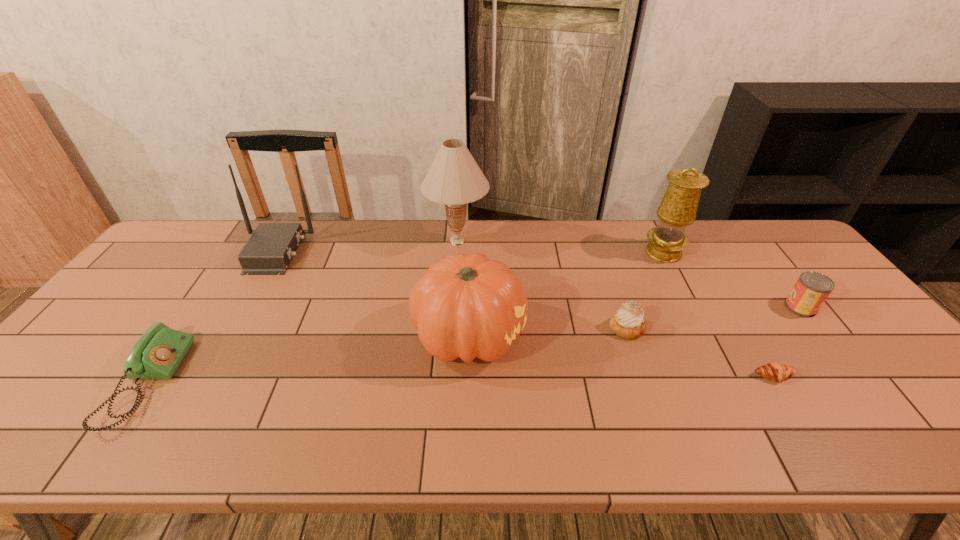
I want to click on lampshade, so click(454, 178).

The height and width of the screenshot is (540, 960). Identify the location of oil lamp. (678, 208).

Where is `router`? This screenshot has width=960, height=540. router is located at coordinates (269, 250).

Locate an element on the screen. This screenshot has width=960, height=540. pumpkin is located at coordinates (466, 306).

Where is `can`? This screenshot has width=960, height=540. can is located at coordinates (811, 290).

At what (x,y) coordinates should I click in order to perform the action: click on the rightmost object. Please return your answer as a coordinate pair (x, y). This screenshot has height=540, width=960. Looking at the image, I should click on (811, 290).

You are a GUI agent. You are given a task and a screenshot of the screen. Output one action in this format:
    pyautogui.click(x=<x>, y=<y>)
    Task: Click on the fourth object from right to left
    Image resolution: width=960 pixels, height=540 pixels.
    Given the screenshot: What is the action you would take?
    pyautogui.click(x=628, y=322)

Where is `the farther pastry`? the farther pastry is located at coordinates (628, 322).

This screenshot has height=540, width=960. Identify the location of telephone. (158, 353).

Locate an element on the screen. Image resolution: width=960 pixels, height=540 pixels. the nearer pastry is located at coordinates 775,371.